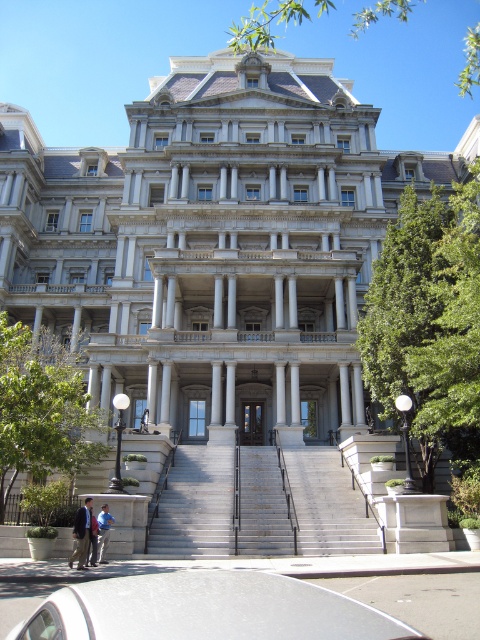
You are a delivery person trying to park your silver metallic car at lower center near the gray concrete stairs at center. Considering the height of the car and stairs, will the car fit under a low clearance bridge that is the same height as the stairs?

The silver metallic car at lower center is taller than the gray concrete stairs at center. Since the bridge has the same height as the stairs, the car will not fit under the bridge because it is taller than the clearance provided by the stairs.